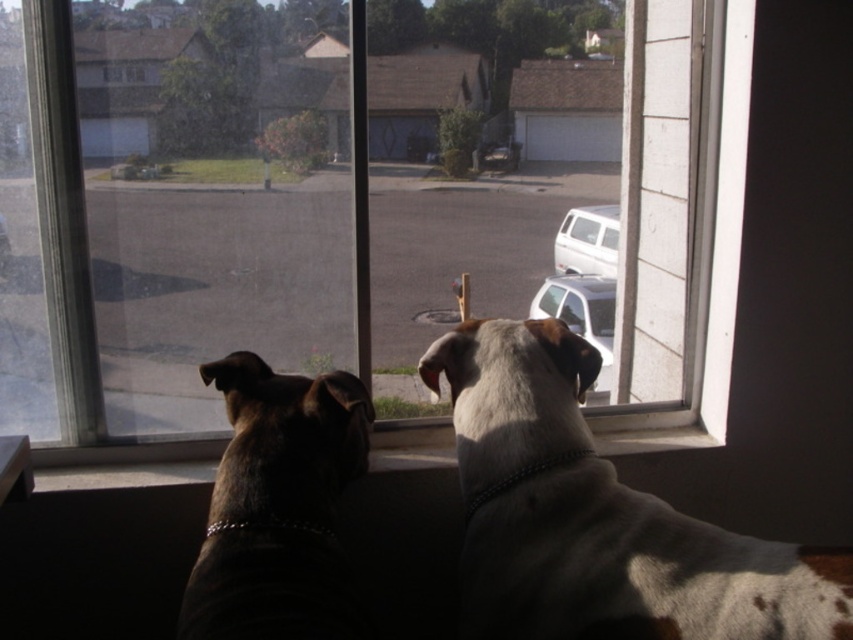
Question: Which point is closer to the camera?

Choices:
 (A) coord(403,113)
 (B) coord(682,410)

Answer: (B)

Question: Is white-spotted fur dog at center smaller than white plastic window sill at lower center?

Choices:
 (A) no
 (B) yes

Answer: (A)

Question: Is white-spotted fur dog at center in front of white plastic window sill at lower center?

Choices:
 (A) no
 (B) yes

Answer: (B)

Question: Which object is positioned farthest from the white plastic window sill at lower center?

Choices:
 (A) white glossy car at center
 (B) white matte van at center
 (C) white-spotted fur dog at center

Answer: (B)

Question: Can you confirm if black leather dog at left is smaller than white glossy car at center?

Choices:
 (A) yes
 (B) no

Answer: (A)

Question: Among these points, which one is farthest from the camera?

Choices:
 (A) (582, 488)
 (B) (61, 467)
 (C) (250, 220)

Answer: (C)